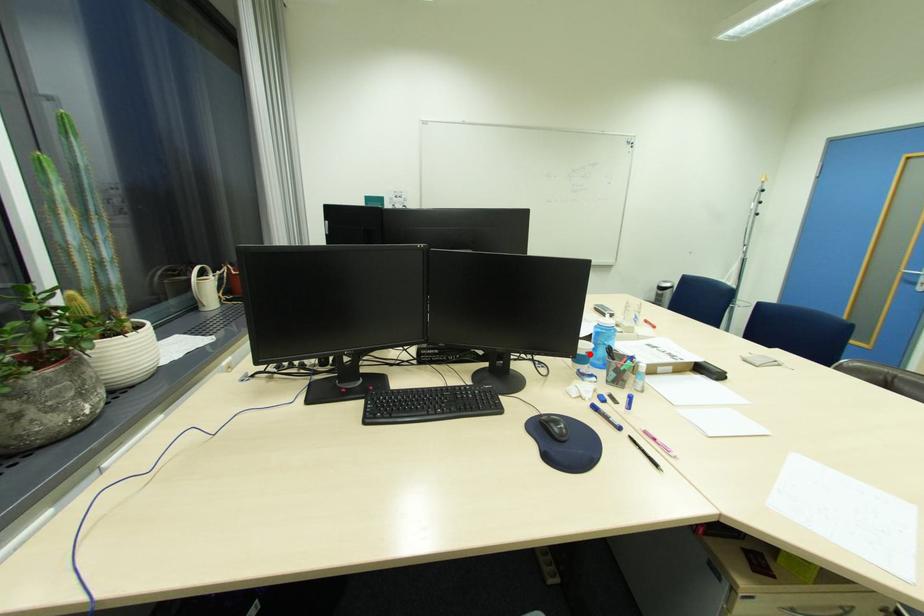
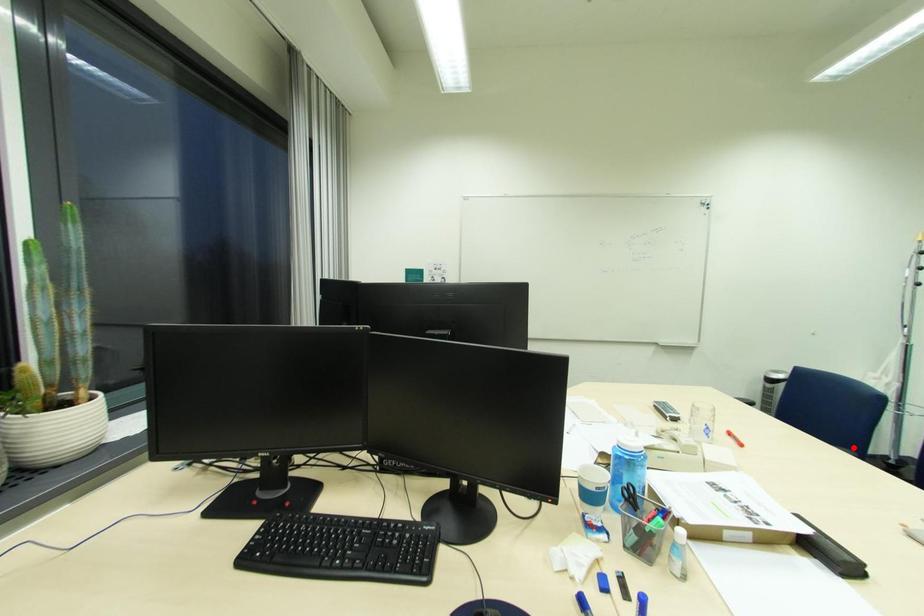
I am providing you with two images of the same scene from different viewpoints. A red point is marked on the first image and another point is marked on the second image. Does the point marked in image1 correspond to the same location as the one in image2?

No